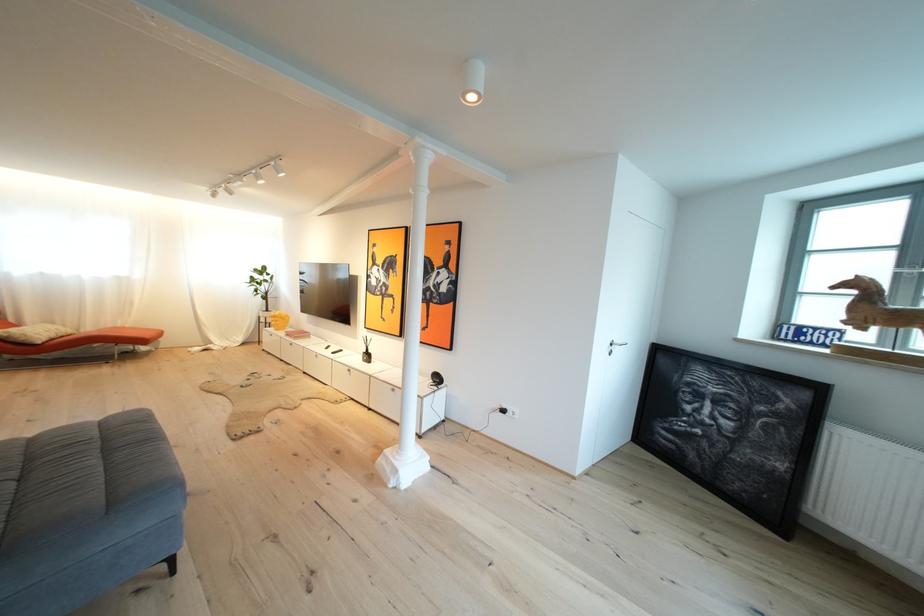
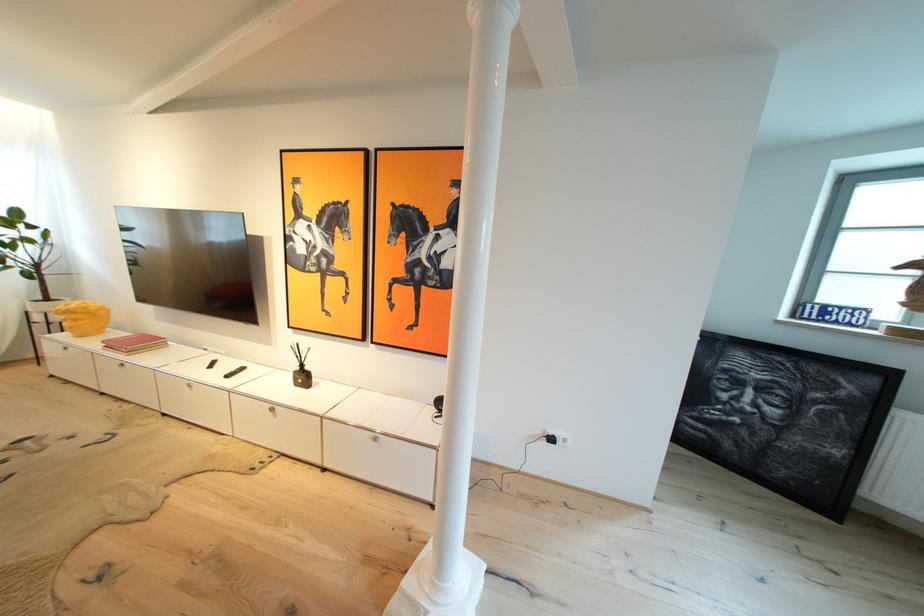
Which direction would the cameraman need to move to produce the second image?

The movement direction of the cameraman is left, forward.